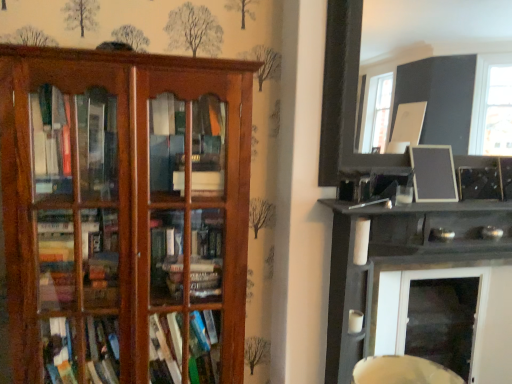
Measure the distance between black matte picture frame at upper right, which appears as the second picture frame when viewed from the top, and camera.

black matte picture frame at upper right, which appears as the second picture frame when viewed from the top, and camera are 1.93 meters apart from each other.

Where is `matte black picture frame at upper right, acting as the 2th picture frame starting from the bottom`? matte black picture frame at upper right, acting as the 2th picture frame starting from the bottom is located at coordinates (343, 94).

The width and height of the screenshot is (512, 384). Describe the element at coordinates (400, 261) in the screenshot. I see `black glossy shelf at upper right, which appears as the second shelf when viewed from the left` at that location.

The width and height of the screenshot is (512, 384). What are the coordinates of `wooden bookshelf at left, the 2th shelf when ordered from right to left` in the screenshot? It's located at (125, 215).

Considering the sizes of objects matte black picture frame at upper right, acting as the 2th picture frame starting from the bottom, and wooden bookshelf at left, which is the 1th shelf in left-to-right order, in the image provided, who is thinner, matte black picture frame at upper right, acting as the 2th picture frame starting from the bottom, or wooden bookshelf at left, which is the 1th shelf in left-to-right order,?

matte black picture frame at upper right, acting as the 2th picture frame starting from the bottom.

Is there a large distance between matte black picture frame at upper right, the 1th picture frame viewed from the top, and wooden bookshelf at left, which is the 1th shelf in left-to-right order?

That's right, there is a large distance between matte black picture frame at upper right, the 1th picture frame viewed from the top, and wooden bookshelf at left, which is the 1th shelf in left-to-right order.

Does point (446, 85) appear closer or farther from the camera than point (185, 358)?

Clearly, point (446, 85) is more distant from the camera than point (185, 358).

Image resolution: width=512 pixels, height=384 pixels. Find the location of `the 1st shelf directly beneath the matte black picture frame at upper right, the 1th picture frame viewed from the top (from a real-world perspective)`. the 1st shelf directly beneath the matte black picture frame at upper right, the 1th picture frame viewed from the top (from a real-world perspective) is located at coordinates (125, 215).

Is black glossy shelf at upper right, positioned as the 1th shelf in right-to-left order, oriented towards matte black picture frame at upper right, the 1th picture frame viewed from the top?

No, black glossy shelf at upper right, positioned as the 1th shelf in right-to-left order, is not facing towards matte black picture frame at upper right, the 1th picture frame viewed from the top.

Which picture frame is the 2nd one when counting from the left side of the black glossy shelf at upper right, which appears as the second shelf when viewed from the left? Please provide its 2D coordinates.

[(343, 94)]

Between black glossy shelf at upper right, which appears as the second shelf when viewed from the left, and matte black picture frame at upper right, the 1th picture frame viewed from the top, which one is positioned behind?

matte black picture frame at upper right, the 1th picture frame viewed from the top.

From the picture: From a real-world perspective, between black glossy shelf at upper right, positioned as the 1th shelf in right-to-left order, and matte black picture frame at upper right, the 1th picture frame viewed from the top, who is vertically lower?

black glossy shelf at upper right, positioned as the 1th shelf in right-to-left order, is physically lower.

From a real-world perspective, is wooden bookshelf at left, the 2th shelf when ordered from right to left, physically located above or below black matte picture frame at upper right, which appears as the second picture frame when viewed from the top?

wooden bookshelf at left, the 2th shelf when ordered from right to left, is situated lower than black matte picture frame at upper right, which appears as the second picture frame when viewed from the top, in the real world.

Considering the positions of objects wooden bookshelf at left, which is the 1th shelf in left-to-right order, and black matte picture frame at upper right, which appears as the second picture frame when viewed from the top, in the image provided, who is behind, wooden bookshelf at left, which is the 1th shelf in left-to-right order, or black matte picture frame at upper right, which appears as the second picture frame when viewed from the top,?

Positioned behind is black matte picture frame at upper right, which appears as the second picture frame when viewed from the top.

Which is closer, (51, 63) or (414, 177)?

Point (51, 63) is closer to the camera than point (414, 177).

How different are the orientations of black matte picture frame at upper right, the first picture frame ordered from the bottom, and wooden bookshelf at left, which is the 1th shelf in left-to-right order, in degrees?

The angular difference between black matte picture frame at upper right, the first picture frame ordered from the bottom, and wooden bookshelf at left, which is the 1th shelf in left-to-right order, is 0.663 degrees.

Between point (422, 173) and point (25, 339), which one is positioned behind?

The point (422, 173) is farther from the camera.

From the picture: Can you confirm if black matte picture frame at upper right, the first picture frame ordered from the bottom, is wider than wooden bookshelf at left, which is the 1th shelf in left-to-right order?

In fact, black matte picture frame at upper right, the first picture frame ordered from the bottom, might be narrower than wooden bookshelf at left, which is the 1th shelf in left-to-right order.

Does black matte picture frame at upper right, which appears as the second picture frame when viewed from the top, come in front of wooden bookshelf at left, which is the 1th shelf in left-to-right order?

No, it is behind wooden bookshelf at left, which is the 1th shelf in left-to-right order.

From a real-world perspective, is wooden bookshelf at left, which is the 1th shelf in left-to-right order, physically located above or below black glossy shelf at upper right, positioned as the 1th shelf in right-to-left order?

Clearly, from a real-world perspective, wooden bookshelf at left, which is the 1th shelf in left-to-right order, is above black glossy shelf at upper right, positioned as the 1th shelf in right-to-left order.

Would you say wooden bookshelf at left, the 2th shelf when ordered from right to left, contains black glossy shelf at upper right, positioned as the 1th shelf in right-to-left order?

No, wooden bookshelf at left, the 2th shelf when ordered from right to left, does not contain black glossy shelf at upper right, positioned as the 1th shelf in right-to-left order.

Is point (48, 96) more distant than point (418, 261)?

That is False.

Where is `shelf located underneath the wooden bookshelf at left, the 2th shelf when ordered from right to left (from a real-world perspective)`? The width and height of the screenshot is (512, 384). shelf located underneath the wooden bookshelf at left, the 2th shelf when ordered from right to left (from a real-world perspective) is located at coordinates pos(400,261).

From the image's perspective, is wooden bookshelf at left, the 2th shelf when ordered from right to left, located beneath matte black picture frame at upper right, acting as the 2th picture frame starting from the bottom?

Yes.

Is wooden bookshelf at left, which is the 1th shelf in left-to-right order, aimed at matte black picture frame at upper right, acting as the 2th picture frame starting from the bottom?

No.

Between wooden bookshelf at left, the 2th shelf when ordered from right to left, and matte black picture frame at upper right, the 1th picture frame viewed from the top, which one has smaller width?

Thinner between the two is matte black picture frame at upper right, the 1th picture frame viewed from the top.

Which is behind, wooden bookshelf at left, the 2th shelf when ordered from right to left, or matte black picture frame at upper right, acting as the 2th picture frame starting from the bottom?

Positioned behind is matte black picture frame at upper right, acting as the 2th picture frame starting from the bottom.

Is point (452, 192) behind point (367, 347)?

That is False.

Is black matte picture frame at upper right, the first picture frame ordered from the bottom, in contact with black glossy shelf at upper right, positioned as the 1th shelf in right-to-left order?

There is a gap between black matte picture frame at upper right, the first picture frame ordered from the bottom, and black glossy shelf at upper right, positioned as the 1th shelf in right-to-left order.

Looking at this image, how far apart are black matte picture frame at upper right, the first picture frame ordered from the bottom, and black glossy shelf at upper right, which appears as the second shelf when viewed from the left?

black matte picture frame at upper right, the first picture frame ordered from the bottom, is 14.63 inches away from black glossy shelf at upper right, which appears as the second shelf when viewed from the left.

Does black matte picture frame at upper right, the first picture frame ordered from the bottom, turn towards black glossy shelf at upper right, which appears as the second shelf when viewed from the left?

No, black matte picture frame at upper right, the first picture frame ordered from the bottom, is not aimed at black glossy shelf at upper right, which appears as the second shelf when viewed from the left.

You are a GUI agent. You are given a task and a screenshot of the screen. Output one action in this format:
    pyautogui.click(x=<x>, y=<y>)
    Task: Click on the picture frame that is the 1st one when counting rightward from the wooden bookshelf at left, the 2th shelf when ordered from right to left
    
    Given the screenshot: What is the action you would take?
    pyautogui.click(x=343, y=94)

From the image's perspective, count 2nd shelfs downward from the matte black picture frame at upper right, acting as the 2th picture frame starting from the bottom, and point to it. Please provide its 2D coordinates.

[(400, 261)]

Based on their spatial positions, is black glossy shelf at upper right, positioned as the 1th shelf in right-to-left order, or black matte picture frame at upper right, which appears as the second picture frame when viewed from the top, further from wooden bookshelf at left, which is the 1th shelf in left-to-right order?

black matte picture frame at upper right, which appears as the second picture frame when viewed from the top, is positioned further to the anchor wooden bookshelf at left, which is the 1th shelf in left-to-right order.

From the image, which object appears to be nearer to wooden bookshelf at left, the 2th shelf when ordered from right to left, black glossy shelf at upper right, positioned as the 1th shelf in right-to-left order, or matte black picture frame at upper right, the 1th picture frame viewed from the top?

black glossy shelf at upper right, positioned as the 1th shelf in right-to-left order, is positioned closer to the anchor wooden bookshelf at left, the 2th shelf when ordered from right to left.

Consider the image. Which object lies nearer to the anchor point matte black picture frame at upper right, acting as the 2th picture frame starting from the bottom, black glossy shelf at upper right, which appears as the second shelf when viewed from the left, or wooden bookshelf at left, which is the 1th shelf in left-to-right order?

black glossy shelf at upper right, which appears as the second shelf when viewed from the left, is closer to matte black picture frame at upper right, acting as the 2th picture frame starting from the bottom.

When comparing their distances from black glossy shelf at upper right, which appears as the second shelf when viewed from the left, does wooden bookshelf at left, which is the 1th shelf in left-to-right order, or matte black picture frame at upper right, acting as the 2th picture frame starting from the bottom, seem closer?

Among the two, matte black picture frame at upper right, acting as the 2th picture frame starting from the bottom, is located nearer to black glossy shelf at upper right, which appears as the second shelf when viewed from the left.

Considering their positions, is matte black picture frame at upper right, the 1th picture frame viewed from the top, positioned closer to black glossy shelf at upper right, positioned as the 1th shelf in right-to-left order, than black matte picture frame at upper right, which appears as the second picture frame when viewed from the top?

Among the two, black matte picture frame at upper right, which appears as the second picture frame when viewed from the top, is located nearer to black glossy shelf at upper right, positioned as the 1th shelf in right-to-left order.

From the image, which object appears to be farther from matte black picture frame at upper right, acting as the 2th picture frame starting from the bottom, black matte picture frame at upper right, the first picture frame ordered from the bottom, or wooden bookshelf at left, the 2th shelf when ordered from right to left?

The object further to matte black picture frame at upper right, acting as the 2th picture frame starting from the bottom, is black matte picture frame at upper right, the first picture frame ordered from the bottom.

Estimate the real-world distances between objects in this image. Which object is further from black matte picture frame at upper right, which appears as the second picture frame when viewed from the top, matte black picture frame at upper right, the 1th picture frame viewed from the top, or wooden bookshelf at left, the 2th shelf when ordered from right to left?

matte black picture frame at upper right, the 1th picture frame viewed from the top, is further to black matte picture frame at upper right, which appears as the second picture frame when viewed from the top.

Looking at the image, which one is located closer to wooden bookshelf at left, the 2th shelf when ordered from right to left, black matte picture frame at upper right, which appears as the second picture frame when viewed from the top, or black glossy shelf at upper right, positioned as the 1th shelf in right-to-left order?

Among the two, black glossy shelf at upper right, positioned as the 1th shelf in right-to-left order, is located nearer to wooden bookshelf at left, the 2th shelf when ordered from right to left.

Locate an element on the screen. picture frame situated between wooden bookshelf at left, the 2th shelf when ordered from right to left, and black matte picture frame at upper right, which appears as the second picture frame when viewed from the top, from left to right is located at coordinates (343, 94).

At what (x,y) coordinates should I click in order to perform the action: click on picture frame between matte black picture frame at upper right, acting as the 2th picture frame starting from the bottom, and black glossy shelf at upper right, which appears as the second shelf when viewed from the left, in the up-down direction. Please return your answer as a coordinate pair (x, y). Image resolution: width=512 pixels, height=384 pixels. Looking at the image, I should click on (433, 173).